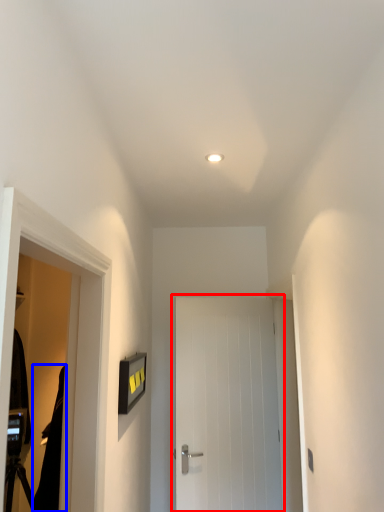
Question: Which of the following is the farthest to the observer, door (highlighted by a red box) or robe (highlighted by a blue box)?

Choices:
 (A) door
 (B) robe

Answer: (A)